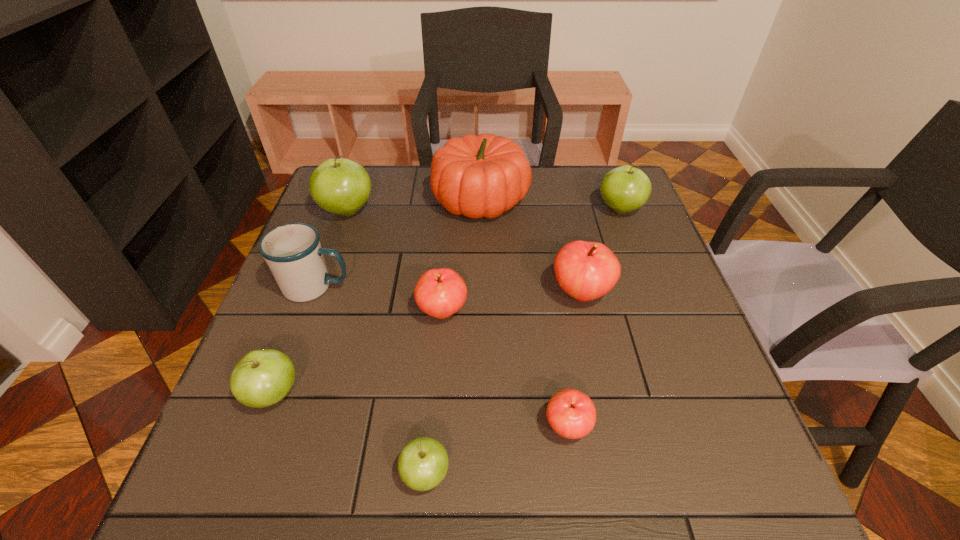
Locate an element on the screen. The height and width of the screenshot is (540, 960). pumpkin is located at coordinates (479, 176).

The image size is (960, 540). I want to click on the tallest apple, so click(x=340, y=186).

In order to click on the biggest red apple in this screenshot , I will do `click(585, 270)`.

The width and height of the screenshot is (960, 540). Find the location of `the rightmost apple`. the rightmost apple is located at coordinates (624, 189).

The width and height of the screenshot is (960, 540). In order to click on the third smallest green apple in this screenshot , I will do `click(624, 189)`.

Identify the location of mug. The image size is (960, 540). (293, 252).

Image resolution: width=960 pixels, height=540 pixels. Identify the location of the second smallest red apple. (441, 292).

Locate an element on the screen. The height and width of the screenshot is (540, 960). the second smallest green apple is located at coordinates (262, 378).

In order to click on the nearest red apple in this screenshot , I will do `click(571, 413)`.

Locate an element on the screen. The width and height of the screenshot is (960, 540). the nearest green apple is located at coordinates (423, 463).